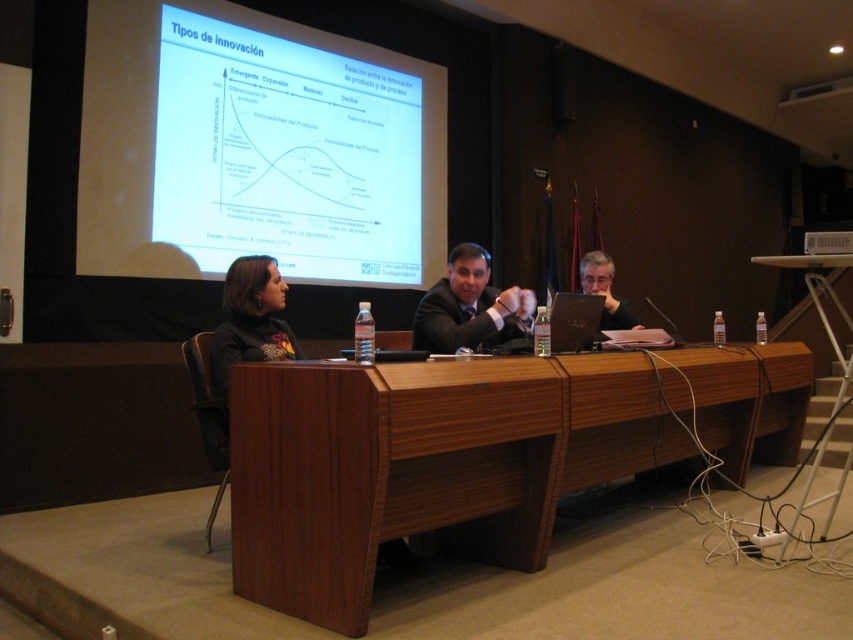
Question: Is dark brown leather jacket at left below black plastic laptop at center?

Choices:
 (A) no
 (B) yes

Answer: (B)

Question: Which is nearer to the dark brown leather jacket at left?

Choices:
 (A) black plastic laptop at center
 (B) brown wood table at center

Answer: (B)

Question: Is white glossy projector screen at upper center wider than black plastic laptop at center?

Choices:
 (A) yes
 (B) no

Answer: (A)

Question: Which point is farther to the camera?

Choices:
 (A) white glossy projector screen at upper center
 (B) dark brown leather jacket at left
 (C) dark suit at center

Answer: (A)

Question: Which object is the farthest from the black plastic laptop at center?

Choices:
 (A) dark brown leather jacket at left
 (B) black plastic projector at upper right
 (C) brown wood table at center

Answer: (A)

Question: Does brown wood table at center have a smaller size compared to dark suit at center?

Choices:
 (A) no
 (B) yes

Answer: (A)